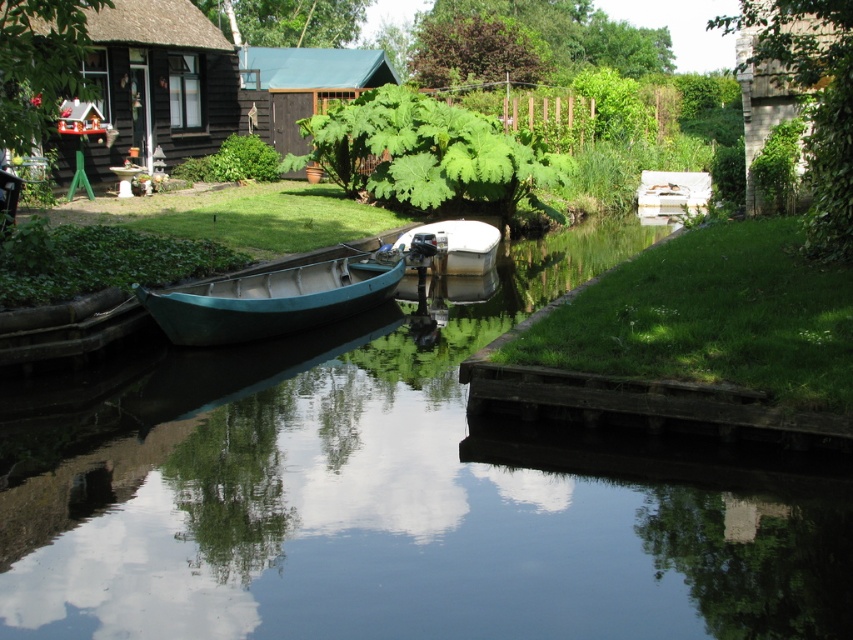
Question: Can you confirm if green smooth water at center is positioned to the left of purple-leaved tree at upper center?

Choices:
 (A) no
 (B) yes

Answer: (B)

Question: Does brown wooden cabin at upper center appear over white matte boat at center?

Choices:
 (A) yes
 (B) no

Answer: (A)

Question: Is dark brown wooden cabin at upper left to the right of green leafy tree at upper center from the viewer's perspective?

Choices:
 (A) no
 (B) yes

Answer: (B)

Question: Which point appears farthest from the camera in this image?

Choices:
 (A) (376, 618)
 (B) (265, 45)
 (C) (332, 93)
 (D) (421, 44)

Answer: (B)

Question: Which point is closer to the camera taking this photo?

Choices:
 (A) (476, 220)
 (B) (849, 56)
 (C) (527, 48)
 (D) (274, 122)

Answer: (B)

Question: Among these points, which one is nearest to the camera?

Choices:
 (A) (265, 35)
 (B) (490, 244)

Answer: (B)